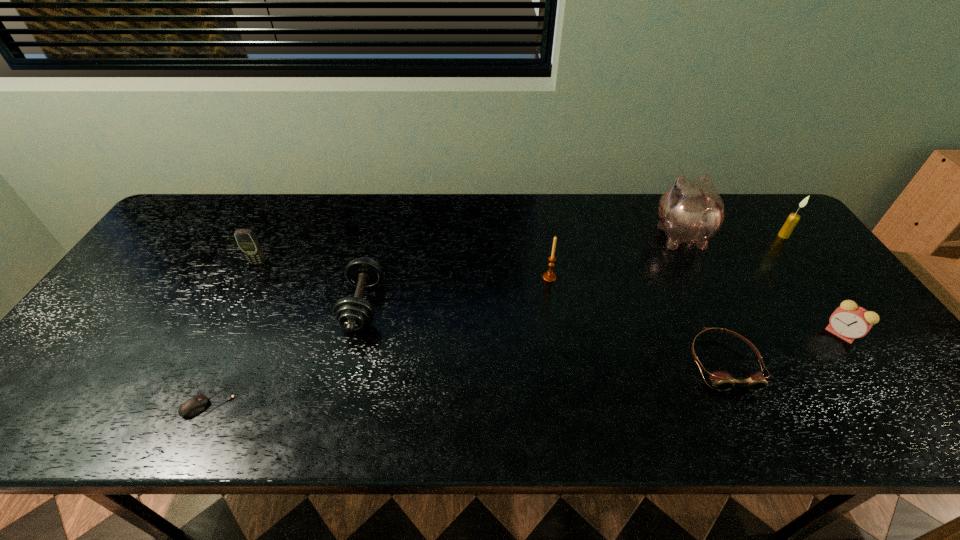
Identify the location of vacant area situated on the front facing side of the piggy bank. The width and height of the screenshot is (960, 540). (662, 198).

Where is `free space located 0.300m on the front of the candle`? The height and width of the screenshot is (540, 960). free space located 0.300m on the front of the candle is located at coordinates click(843, 314).

Where is `blank area located 0.100m on the left of the candle_holder`? blank area located 0.100m on the left of the candle_holder is located at coordinates (507, 278).

Where is `free space located 0.210m on the front face of the fourth tallest object`? free space located 0.210m on the front face of the fourth tallest object is located at coordinates (227, 323).

Where is `vacant space located 0.380m on the left of the sixth object from right to left`? This screenshot has width=960, height=540. vacant space located 0.380m on the left of the sixth object from right to left is located at coordinates (199, 306).

Image resolution: width=960 pixels, height=540 pixels. In order to click on free location located 0.260m on the face of the alarm clock in this screenshot , I will do click(x=720, y=333).

Identify the location of free space located on the face of the alarm clock. The image size is (960, 540). (732, 333).

Identify the location of free space located on the face of the alarm clock. The height and width of the screenshot is (540, 960). point(668,333).

Identify the location of free space located 0.070m through the lenses of the second shortest object. (751, 423).

Where is `vacant region located on the left of the shortest object`? The width and height of the screenshot is (960, 540). vacant region located on the left of the shortest object is located at coordinates (76, 403).